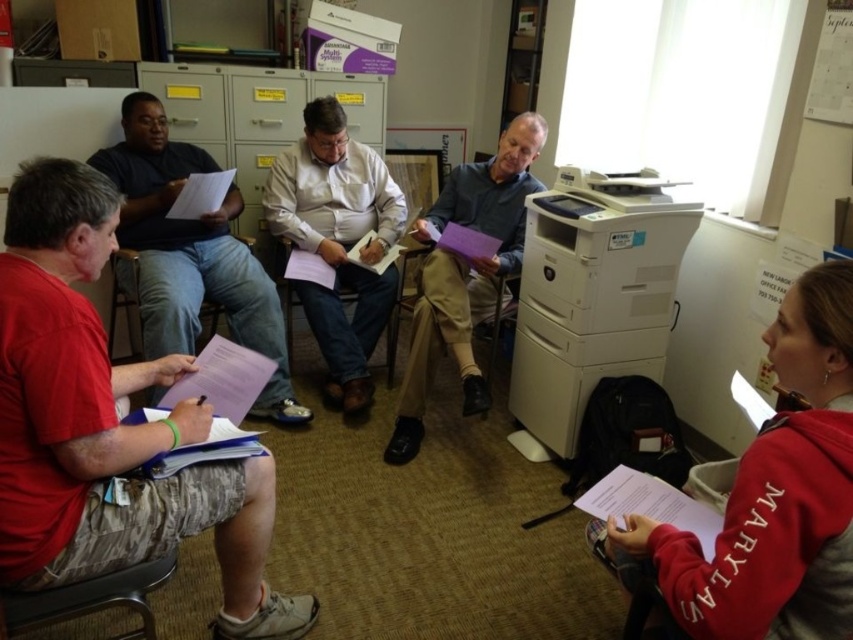
Is brown fabric chair at center positioned behind matte plastic chair at lower left?

No, brown fabric chair at center is closer to the viewer.

Is brown fabric chair at center to the right of matte plastic chair at lower left from the viewer's perspective?

Indeed, brown fabric chair at center is positioned on the right side of matte plastic chair at lower left.

This screenshot has width=853, height=640. What do you see at coordinates (456, 305) in the screenshot? I see `brown fabric chair at center` at bounding box center [456, 305].

Where is `brown fabric chair at center`? brown fabric chair at center is located at coordinates (456, 305).

Can you confirm if white matte printer at right is positioned to the left of matte plastic chair at lower left?

No, white matte printer at right is not to the left of matte plastic chair at lower left.

Is white matte printer at right bigger than matte plastic chair at lower left?

Indeed, white matte printer at right has a larger size compared to matte plastic chair at lower left.

Which is behind, point (596, 269) or point (108, 342)?

Positioned behind is point (108, 342).

This screenshot has width=853, height=640. Find the location of `white matte printer at right`. white matte printer at right is located at coordinates (593, 294).

Is point (834, 547) more distant than point (514, 360)?

No, (834, 547) is in front of (514, 360).

Find the location of a particular element. red fleece sweatshirt at lower right is located at coordinates (766, 499).